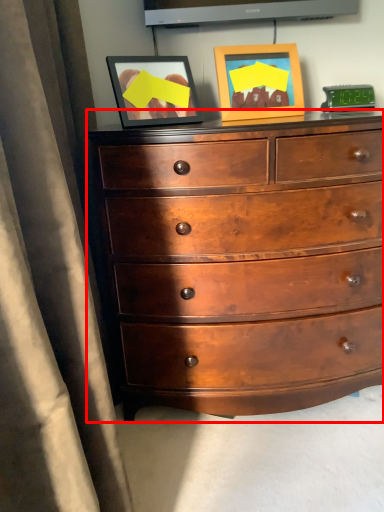
Question: In this image, where is chest of drawers (annotated by the red box) located relative to picture frame?

Choices:
 (A) left
 (B) right

Answer: (A)